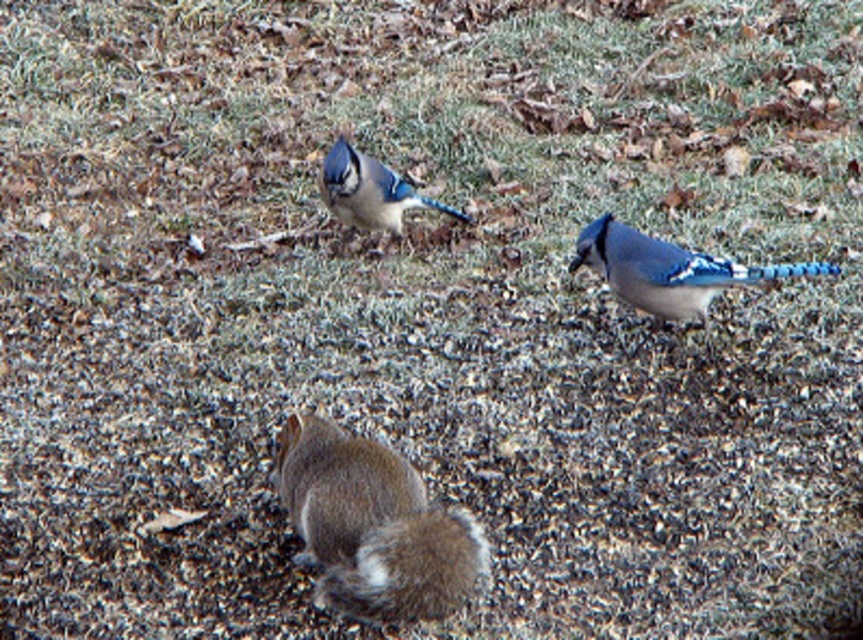
Is fuzzy brown squirrel at center wider than blue glossy bird at upper right?

No, fuzzy brown squirrel at center is not wider than blue glossy bird at upper right.

Does point (484, 547) come behind point (641, 280)?

No, it is not.

You are a GUI agent. You are given a task and a screenshot of the screen. Output one action in this format:
    pyautogui.click(x=<x>, y=<y>)
    Task: Click on the fuzzy brown squirrel at center
    
    Given the screenshot: What is the action you would take?
    pyautogui.click(x=375, y=525)

Does point (394, 529) come closer to viewer compared to point (389, 214)?

Yes, it is.

Between fuzzy brown squirrel at center and blue glossy bird at center, which one has less height?

Standing shorter between the two is blue glossy bird at center.

Which is in front, point (370, 468) or point (369, 209)?

Point (370, 468)

You are a GUI agent. You are given a task and a screenshot of the screen. Output one action in this format:
    pyautogui.click(x=<x>, y=<y>)
    Task: Click on the fuzzy brown squirrel at center
    The width and height of the screenshot is (863, 640).
    Given the screenshot: What is the action you would take?
    pyautogui.click(x=375, y=525)

Which is below, blue glossy bird at upper right or blue glossy bird at center?

Positioned lower is blue glossy bird at upper right.

Who is more forward, (618, 289) or (334, 160)?

Point (618, 289) is in front.

Describe the element at coordinates (669, 269) in the screenshot. I see `blue glossy bird at upper right` at that location.

Locate an element on the screen. The width and height of the screenshot is (863, 640). blue glossy bird at upper right is located at coordinates (669, 269).